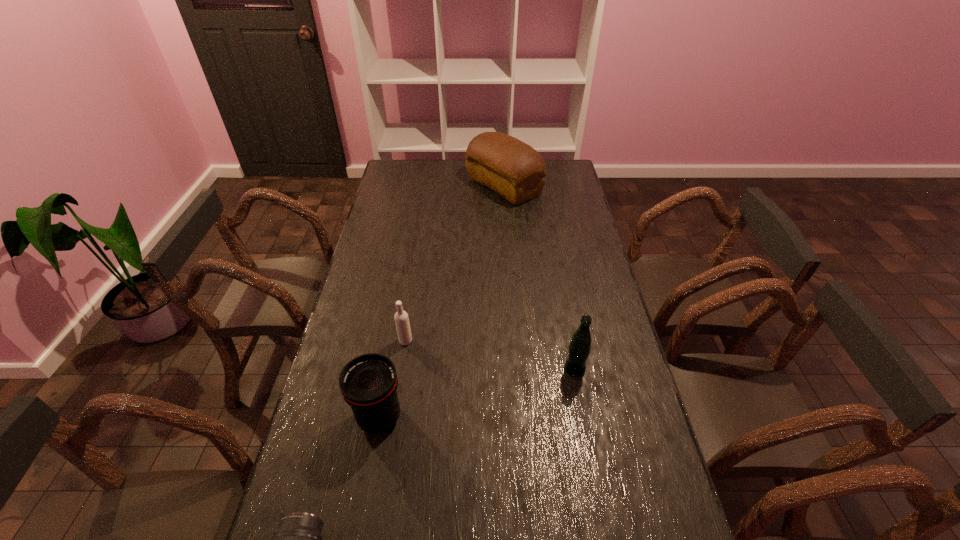
Locate which object is the third closest to the vodka. Please provide its 2D coordinates. Your answer should be formatted as a tuple, i.e. [(x, y)], where the tuple contains the x and y coordinates of a point satisfying the conditions above.

[(298, 539)]

At what (x,y) coordinates should I click in order to perform the action: click on the fourth closest object to the third nearest object. Please return your answer as a coordinate pair (x, y). Looking at the image, I should click on (513, 169).

Identify the location of free space that satisfies the following two spatial constraints: 1. on the back side of the vodka; 2. on the left side of the bread. The width and height of the screenshot is (960, 540). (430, 186).